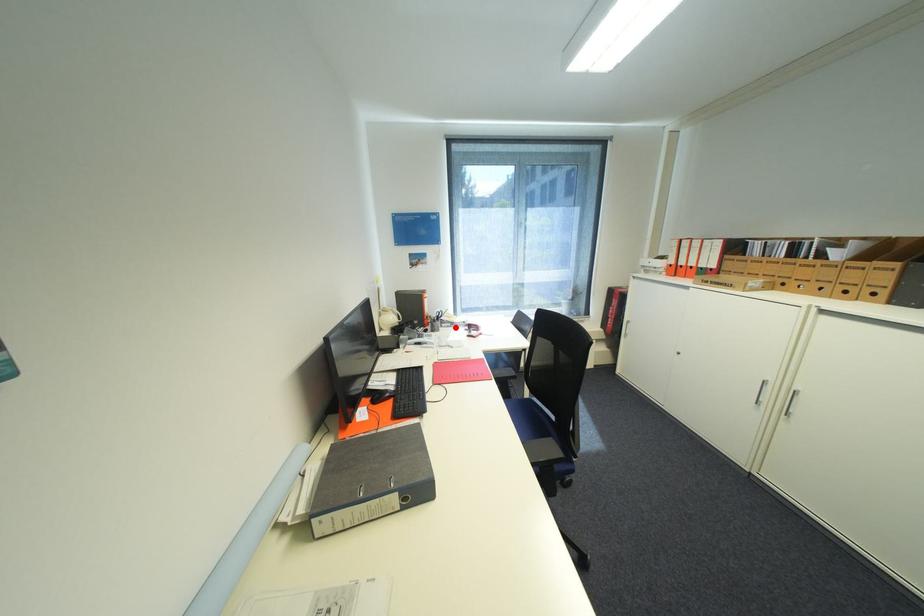
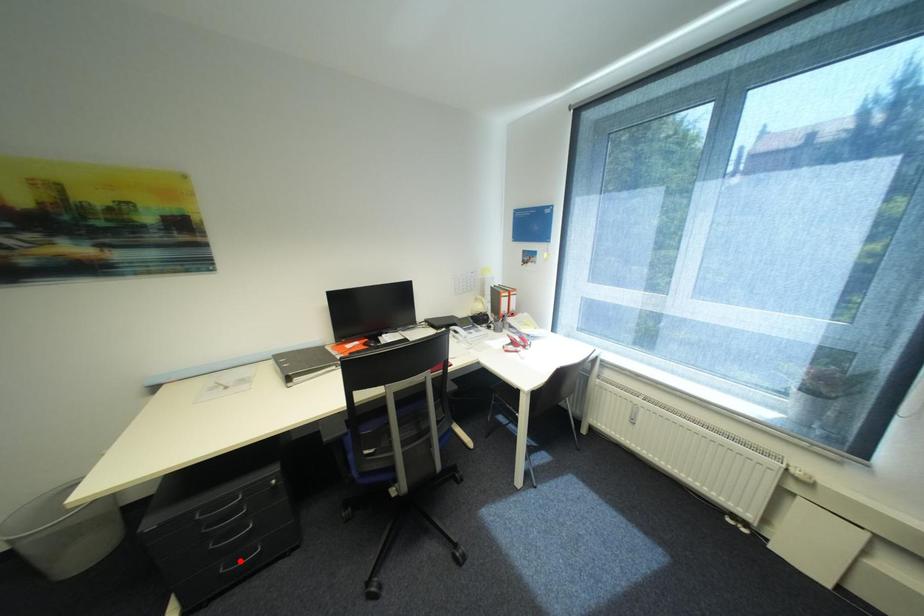
I am providing you with two images of the same scene from different viewpoints. A red point is marked on the first image and another point is marked on the second image. Is the red point in image1 aligned with the point shown in image2?

No